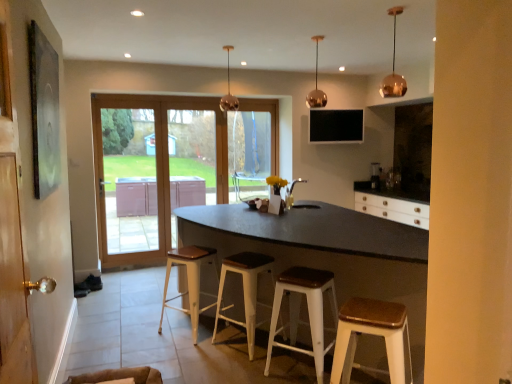
Locate an element on the screen. The height and width of the screenshot is (384, 512). vacant space underneath copper metallic pendant light at upper right, marked as the 3th light fixture in a left-to-right arrangement (from a real-world perspective) is located at coordinates (390, 229).